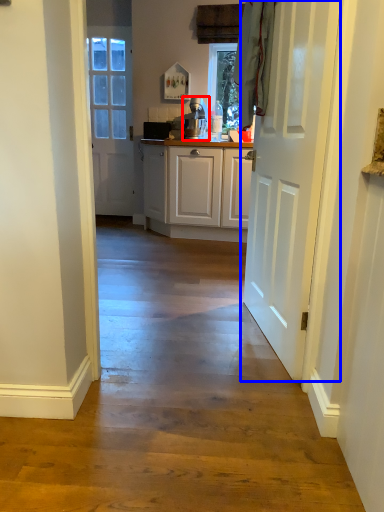
Question: Among these objects, which one is nearest to the camera, appliance (highlighted by a red box) or door (highlighted by a blue box)?

Choices:
 (A) appliance
 (B) door

Answer: (B)